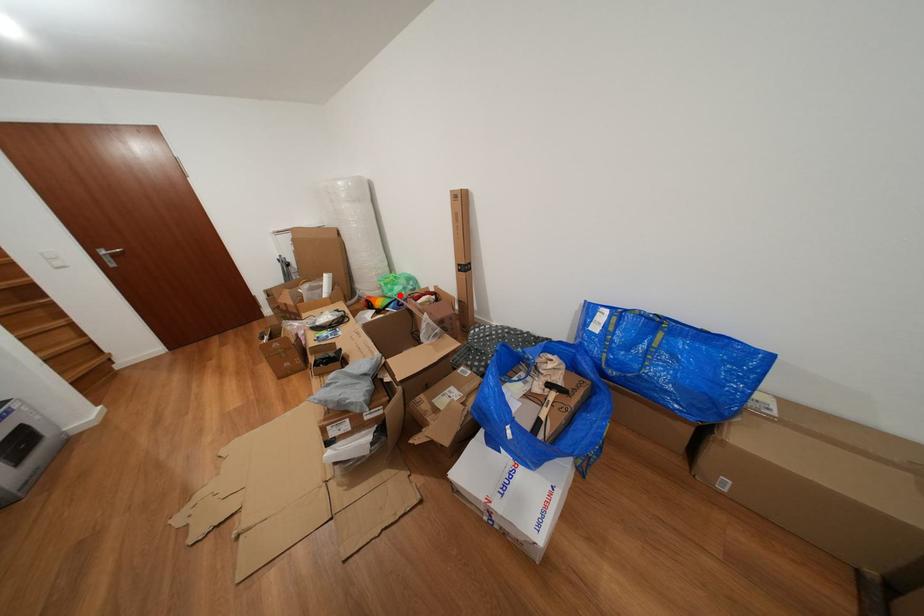
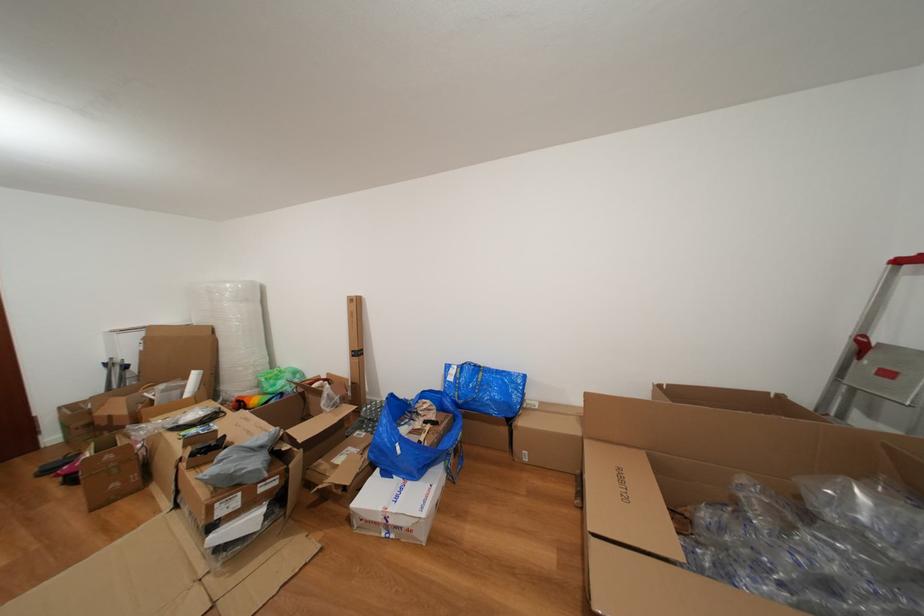
Question: A red point is marked in image1. In image2, is the corresponding 3D point closer to the camera or farther? Reply with the corresponding letter.

Choices:
 (A) The corresponding 3D point is closer.
 (B) The corresponding 3D point is farther.

Answer: (A)